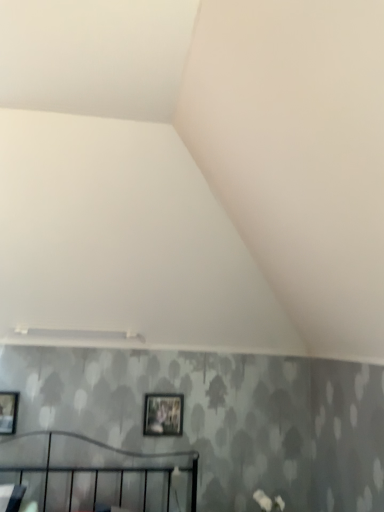
Question: Relative to matte black picture frame at center, marked as the 1th picture frame in a back-to-front arrangement, is matte black picture frame at left, the 2th picture frame viewed from the right, in front or behind?

Choices:
 (A) behind
 (B) front

Answer: (B)

Question: In terms of size, does matte black picture frame at left, the 1th picture frame viewed from the front, appear bigger or smaller than matte black picture frame at center, which is the second picture frame in left-to-right order?

Choices:
 (A) small
 (B) big

Answer: (B)

Question: Which of these objects is positioned closest to the matte black picture frame at center, positioned as the 1th picture frame in right-to-left order?

Choices:
 (A) white matte flower at lower right
 (B) matte black picture frame at left, marked as the first picture frame in a left-to-right arrangement

Answer: (A)

Question: Based on their relative distances, which object is nearer to the white matte flower at lower right?

Choices:
 (A) matte black picture frame at left, the 2th picture frame viewed from the right
 (B) matte black picture frame at center, positioned as the 2th picture frame in front-to-back order

Answer: (B)